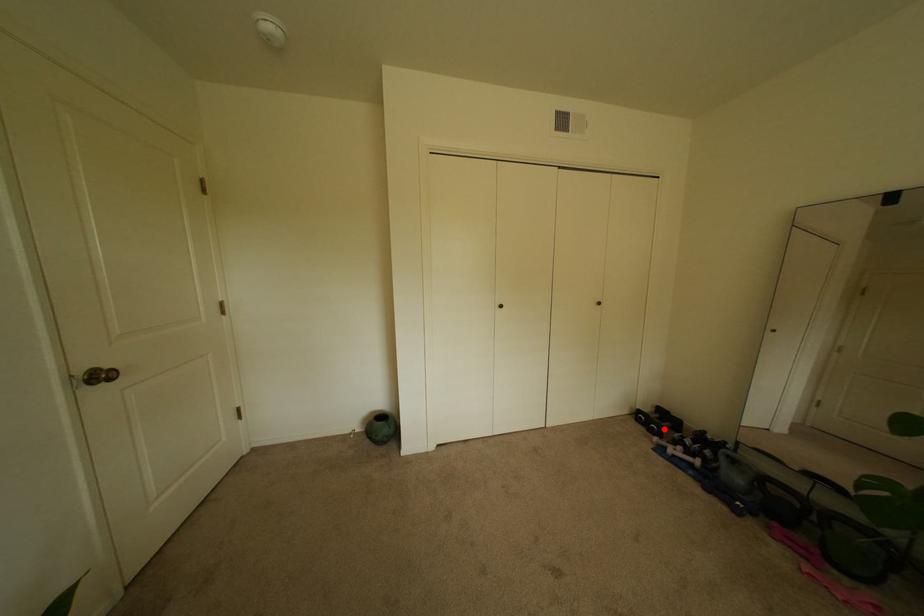
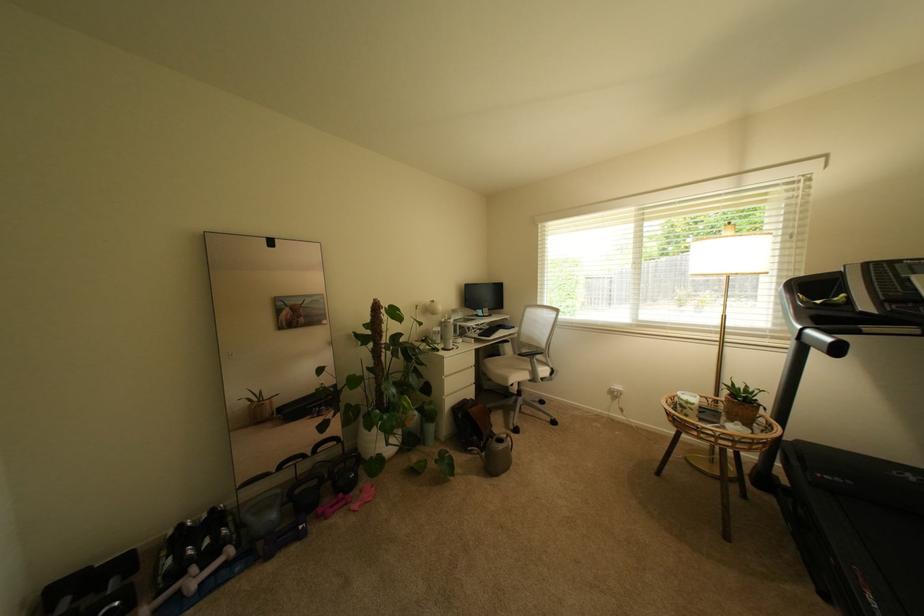
Question: I am providing you with two images of the same scene from different viewpoints. Image1 has a red point marked. In image2, the corresponding 3D location appears at what relative position? Reply with the corresponding letter.

Choices:
 (A) Closer
 (B) Farther

Answer: (A)